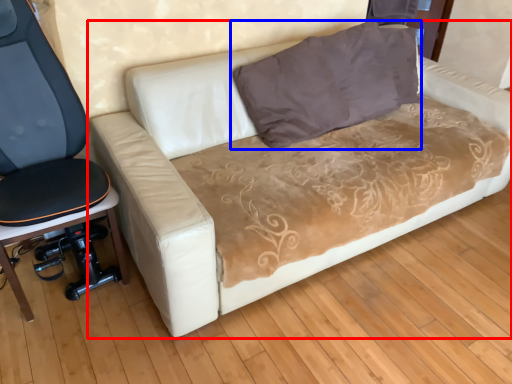
Question: Which point is closer to the camera, studio couch (highlighted by a red box) or pillow (highlighted by a blue box)?

Choices:
 (A) studio couch
 (B) pillow

Answer: (A)